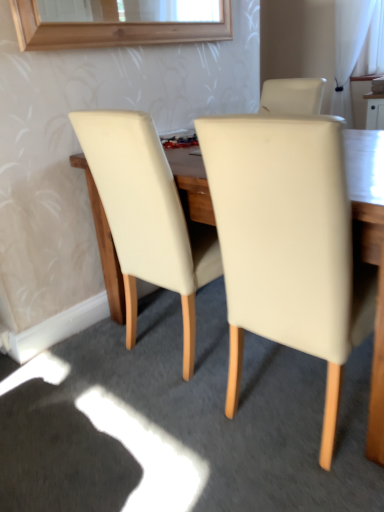
Question: From the image's perspective, does beige leather chair at center, marked as the second chair in a left-to-right arrangement, appear higher than white sheer curtain at upper right?

Choices:
 (A) no
 (B) yes

Answer: (A)

Question: Is beige leather chair at center, acting as the 1th chair starting from the right, facing towards white sheer curtain at upper right?

Choices:
 (A) no
 (B) yes

Answer: (B)

Question: Is beige leather chair at center, marked as the second chair in a left-to-right arrangement, shorter than white sheer curtain at upper right?

Choices:
 (A) yes
 (B) no

Answer: (B)

Question: From a real-world perspective, does beige leather chair at center, acting as the 1th chair starting from the right, stand above white sheer curtain at upper right?

Choices:
 (A) no
 (B) yes

Answer: (A)

Question: Can you confirm if beige leather chair at center, acting as the 1th chair starting from the right, is positioned to the right of white sheer curtain at upper right?

Choices:
 (A) no
 (B) yes

Answer: (A)

Question: From the image's perspective, is beige leather chair at center, marked as the second chair in a left-to-right arrangement, above or below white sheer curtain at upper right?

Choices:
 (A) above
 (B) below

Answer: (B)

Question: Relative to white sheer curtain at upper right, is beige leather chair at center, acting as the 1th chair starting from the right, in front or behind?

Choices:
 (A) front
 (B) behind

Answer: (A)

Question: In terms of height, does beige leather chair at center, marked as the second chair in a left-to-right arrangement, look taller or shorter compared to white sheer curtain at upper right?

Choices:
 (A) tall
 (B) short

Answer: (A)

Question: Is beige leather chair at center, marked as the second chair in a left-to-right arrangement, inside or outside of white sheer curtain at upper right?

Choices:
 (A) outside
 (B) inside

Answer: (A)

Question: In terms of size, does white sheer curtain at upper right appear bigger or smaller than beige leather chair at center, arranged as the 2th chair when viewed from the right?

Choices:
 (A) big
 (B) small

Answer: (B)

Question: In terms of width, does white sheer curtain at upper right look wider or thinner when compared to beige leather chair at center, which is counted as the 1th chair, starting from the left?

Choices:
 (A) thin
 (B) wide

Answer: (A)

Question: Do you think white sheer curtain at upper right is within beige leather chair at center, arranged as the 2th chair when viewed from the right, or outside of it?

Choices:
 (A) outside
 (B) inside

Answer: (A)

Question: From the image's perspective, relative to beige leather chair at center, arranged as the 2th chair when viewed from the right, is white sheer curtain at upper right above or below?

Choices:
 (A) above
 (B) below

Answer: (A)

Question: Considering the positions of beige leather chair at center, which is counted as the 1th chair, starting from the left, and beige leather chair at center, acting as the 1th chair starting from the right, in the image, is beige leather chair at center, which is counted as the 1th chair, starting from the left, wider or thinner than beige leather chair at center, acting as the 1th chair starting from the right,?

Choices:
 (A) wide
 (B) thin

Answer: (B)

Question: In the image, is beige leather chair at center, arranged as the 2th chair when viewed from the right, on the left side or the right side of beige leather chair at center, acting as the 1th chair starting from the right?

Choices:
 (A) left
 (B) right

Answer: (A)